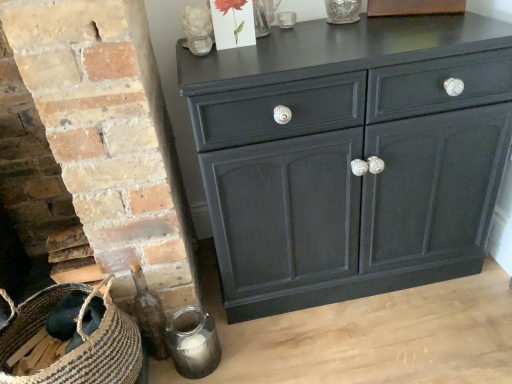
The image size is (512, 384). What do you see at coordinates (342, 11) in the screenshot?
I see `transparent glass vase at upper center` at bounding box center [342, 11].

The image size is (512, 384). I want to click on matte paper card at upper center, the first flower from the right, so click(x=232, y=11).

The height and width of the screenshot is (384, 512). I want to click on transparent glass vase at upper center, so 342,11.

Is brown woven basket at lower left in contact with translucent glass flower at upper center, which is the first flower from left to right?

There is a gap between brown woven basket at lower left and translucent glass flower at upper center, which is the first flower from left to right.

Is translucent glass flower at upper center, which is the first flower from left to right, at the back of brown woven basket at lower left?

No.

Is brown woven basket at lower left positioned beyond the bounds of translucent glass flower at upper center, which is the 2th flower from right to left?

Yes, brown woven basket at lower left is located beyond the bounds of translucent glass flower at upper center, which is the 2th flower from right to left.

How distant is brown woven basket at lower left from translucent glass flower at upper center, which is the first flower from left to right?

A distance of 32.20 inches exists between brown woven basket at lower left and translucent glass flower at upper center, which is the first flower from left to right.

Which is correct: matte paper card at upper center, which is the 2th flower in left-to-right order, is inside matte black cabinet at center, or outside of it?

matte paper card at upper center, which is the 2th flower in left-to-right order, cannot be found inside matte black cabinet at center.

Is matte paper card at upper center, which is the 2th flower in left-to-right order, positioned with its back to matte black cabinet at center?

No, matte black cabinet at center is not at the back of matte paper card at upper center, which is the 2th flower in left-to-right order.

Are matte paper card at upper center, the first flower from the right, and matte black cabinet at center making contact?

No, matte paper card at upper center, the first flower from the right, is not beside matte black cabinet at center.

What's the angular difference between matte paper card at upper center, which is the 2th flower in left-to-right order, and matte black cabinet at center's facing directions?

The facing directions of matte paper card at upper center, which is the 2th flower in left-to-right order, and matte black cabinet at center are 0.555 degrees apart.

Looking at this image, considering the positions of objects transparent glass vase at upper center and brown woven basket at lower left in the image provided, who is behind, transparent glass vase at upper center or brown woven basket at lower left?

transparent glass vase at upper center is further away from the camera.

The image size is (512, 384). I want to click on glass vase located above the brown woven basket at lower left (from a real-world perspective), so click(342, 11).

Looking at this image, how many degrees apart are the facing directions of transparent glass vase at upper center and brown woven basket at lower left?

They differ by 1.09 degrees in their facing directions.

Which is in front, point (98, 317) or point (325, 5)?

The point (98, 317) is closer to the camera.

Who is smaller, brown woven basket at lower left or transparent glass vase at upper center?

transparent glass vase at upper center is smaller.

Considering the relative sizes of brown woven basket at lower left and transparent glass vase at upper center in the image provided, is brown woven basket at lower left shorter than transparent glass vase at upper center?

No, brown woven basket at lower left is not shorter than transparent glass vase at upper center.

From the image's perspective, between brown woven basket at lower left and transparent glass vase at upper center, who is located below?

brown woven basket at lower left appears lower in the image.

Considering the relative sizes of matte black cabinet at center and brown woven basket at lower left in the image provided, is matte black cabinet at center smaller than brown woven basket at lower left?

Actually, matte black cabinet at center might be larger than brown woven basket at lower left.

Which object is positioned more to the left, matte black cabinet at center or brown woven basket at lower left?

brown woven basket at lower left.

Is matte black cabinet at center next to brown woven basket at lower left?

matte black cabinet at center and brown woven basket at lower left are not in contact.

From the image's perspective, between matte black cabinet at center and brown woven basket at lower left, which one is located above?

matte black cabinet at center.

Can you tell me how much matte paper card at upper center, which is the 2th flower in left-to-right order, and brown woven basket at lower left differ in facing direction?

The facing directions of matte paper card at upper center, which is the 2th flower in left-to-right order, and brown woven basket at lower left are 0.596 degrees apart.

Who is smaller, matte paper card at upper center, which is the 2th flower in left-to-right order, or brown woven basket at lower left?

matte paper card at upper center, which is the 2th flower in left-to-right order, is smaller.

Which of these two, matte paper card at upper center, which is the 2th flower in left-to-right order, or brown woven basket at lower left, stands shorter?

matte paper card at upper center, which is the 2th flower in left-to-right order.

Are matte black cabinet at center and matte paper card at upper center, the first flower from the right, beside each other?

No.

From a real-world perspective, is matte black cabinet at center beneath matte paper card at upper center, the first flower from the right?

Indeed, from a real-world perspective, matte black cabinet at center is positioned beneath matte paper card at upper center, the first flower from the right.

Is matte black cabinet at center to the left of matte paper card at upper center, which is the 2th flower in left-to-right order, from the viewer's perspective?

No, matte black cabinet at center is not to the left of matte paper card at upper center, which is the 2th flower in left-to-right order.

Which object is wider, matte black cabinet at center or matte paper card at upper center, the first flower from the right?

matte black cabinet at center is wider.

Identify the location of basket below the translucent glass flower at upper center, which is the first flower from left to right (from the image's perspective). (71, 337).

You are a GUI agent. You are given a task and a screenshot of the screen. Output one action in this format:
    pyautogui.click(x=<x>, y=<y>)
    Task: Click on the flower that is the 1st object located above the matte black cabinet at center (from the image's perspective)
    This screenshot has width=512, height=384.
    Given the screenshot: What is the action you would take?
    pyautogui.click(x=232, y=11)

Based on their spatial positions, is transparent glass vase at upper center or matte paper card at upper center, which is the 2th flower in left-to-right order, closer to brown woven basket at lower left?

Based on the image, matte paper card at upper center, which is the 2th flower in left-to-right order, appears to be nearer to brown woven basket at lower left.

From the image, which object appears to be nearer to translucent glass flower at upper center, which is the 2th flower from right to left, brown woven basket at lower left or transparent glass vase at upper center?

transparent glass vase at upper center is positioned closer to the anchor translucent glass flower at upper center, which is the 2th flower from right to left.

Based on their spatial positions, is translucent glass flower at upper center, which is the 2th flower from right to left, or transparent glass vase at upper center further from brown woven basket at lower left?

transparent glass vase at upper center is further to brown woven basket at lower left.

Considering their positions, is brown woven basket at lower left positioned further to matte black cabinet at center than matte paper card at upper center, the first flower from the right?

Based on the image, brown woven basket at lower left appears to be further to matte black cabinet at center.

Estimate the real-world distances between objects in this image. Which object is further from translucent glass flower at upper center, which is the 2th flower from right to left, matte black cabinet at center or brown woven basket at lower left?

The object further to translucent glass flower at upper center, which is the 2th flower from right to left, is brown woven basket at lower left.

When comparing their distances from matte paper card at upper center, the first flower from the right, does transparent glass vase at upper center or translucent glass flower at upper center, which is the first flower from left to right, seem closer?

translucent glass flower at upper center, which is the first flower from left to right, is closer to matte paper card at upper center, the first flower from the right.

Estimate the real-world distances between objects in this image. Which object is closer to brown woven basket at lower left, translucent glass flower at upper center, which is the 2th flower from right to left, or matte black cabinet at center?

matte black cabinet at center is closer to brown woven basket at lower left.

Looking at the image, which one is located closer to matte paper card at upper center, the first flower from the right, translucent glass flower at upper center, which is the 2th flower from right to left, or brown woven basket at lower left?

Among the two, translucent glass flower at upper center, which is the 2th flower from right to left, is located nearer to matte paper card at upper center, the first flower from the right.

Locate an element on the screen. This screenshot has width=512, height=384. chest of drawers between translucent glass flower at upper center, which is the 2th flower from right to left, and brown woven basket at lower left in the up-down direction is located at coordinates (351, 156).

Find the location of `flower between translucent glass flower at upper center, which is the 2th flower from right to left, and brown woven basket at lower left in the up-down direction`. flower between translucent glass flower at upper center, which is the 2th flower from right to left, and brown woven basket at lower left in the up-down direction is located at coordinates (232, 11).

At what (x,y) coordinates should I click in order to perform the action: click on flower situated between translucent glass flower at upper center, which is the first flower from left to right, and matte black cabinet at center from left to right. Please return your answer as a coordinate pair (x, y). The image size is (512, 384). Looking at the image, I should click on pos(232,11).

I want to click on flower located between translucent glass flower at upper center, which is the 2th flower from right to left, and transparent glass vase at upper center in the left-right direction, so click(x=232, y=11).